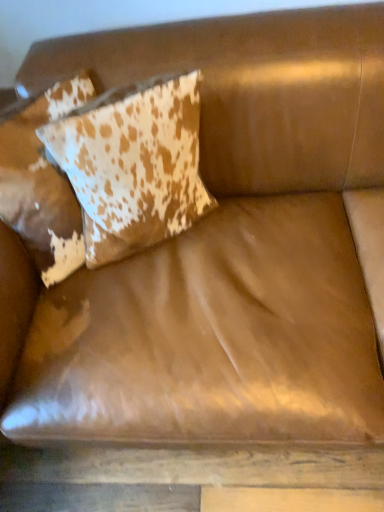
Question: From the image's perspective, is cowhide pillow at upper left, which is the first pillow from right to left, below cowhide pillow at upper left, which ranks as the first pillow in left-to-right order?

Choices:
 (A) yes
 (B) no

Answer: (B)

Question: Is cowhide pillow at upper left, which ranks as the first pillow in left-to-right order, at the back of cowhide pillow at upper left, which appears as the 2th pillow when viewed from the left?

Choices:
 (A) yes
 (B) no

Answer: (A)

Question: Is cowhide pillow at upper left, which is the first pillow from right to left, positioned far away from cowhide pillow at upper left, which ranks as the first pillow in left-to-right order?

Choices:
 (A) yes
 (B) no

Answer: (B)

Question: Is cowhide pillow at upper left, which appears as the 2th pillow when viewed from the left, smaller than cowhide pillow at upper left, which ranks as the second pillow in right-to-left order?

Choices:
 (A) no
 (B) yes

Answer: (B)

Question: Is cowhide pillow at upper left, which is the first pillow from right to left, thinner than cowhide pillow at upper left, which ranks as the second pillow in right-to-left order?

Choices:
 (A) yes
 (B) no

Answer: (A)

Question: Does cowhide pillow at upper left, which appears as the 2th pillow when viewed from the left, have a greater height compared to cowhide pillow at upper left, which ranks as the first pillow in left-to-right order?

Choices:
 (A) yes
 (B) no

Answer: (A)

Question: Is cowhide pillow at upper left, which ranks as the second pillow in right-to-left order, oriented away from cowhide pillow at upper left, which is the first pillow from right to left?

Choices:
 (A) yes
 (B) no

Answer: (B)

Question: From a real-world perspective, is cowhide pillow at upper left, which ranks as the second pillow in right-to-left order, physically below cowhide pillow at upper left, which appears as the 2th pillow when viewed from the left?

Choices:
 (A) no
 (B) yes

Answer: (B)

Question: Is cowhide pillow at upper left, which ranks as the first pillow in left-to-right order, not inside cowhide pillow at upper left, which is the first pillow from right to left?

Choices:
 (A) yes
 (B) no

Answer: (A)

Question: Is cowhide pillow at upper left, which ranks as the first pillow in left-to-right order, far away from cowhide pillow at upper left, which is the first pillow from right to left?

Choices:
 (A) yes
 (B) no

Answer: (B)

Question: From a real-world perspective, does cowhide pillow at upper left, which ranks as the second pillow in right-to-left order, stand above cowhide pillow at upper left, which is the first pillow from right to left?

Choices:
 (A) yes
 (B) no

Answer: (B)

Question: Is cowhide pillow at upper left, which ranks as the second pillow in right-to-left order, directly adjacent to cowhide pillow at upper left, which appears as the 2th pillow when viewed from the left?

Choices:
 (A) no
 (B) yes

Answer: (A)

Question: Do you think cowhide pillow at upper left, which appears as the 2th pillow when viewed from the left, is within cowhide pillow at upper left, which ranks as the first pillow in left-to-right order, or outside of it?

Choices:
 (A) inside
 (B) outside

Answer: (A)